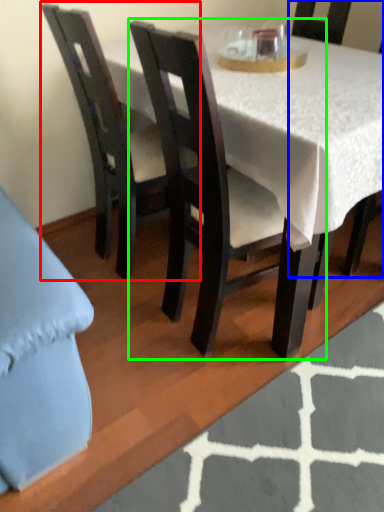
Question: Estimate the real-world distances between objects in this image. Which object is farther from chair (highlighted by a red box), chair (highlighted by a blue box) or chair (highlighted by a green box)?

Choices:
 (A) chair
 (B) chair

Answer: (A)